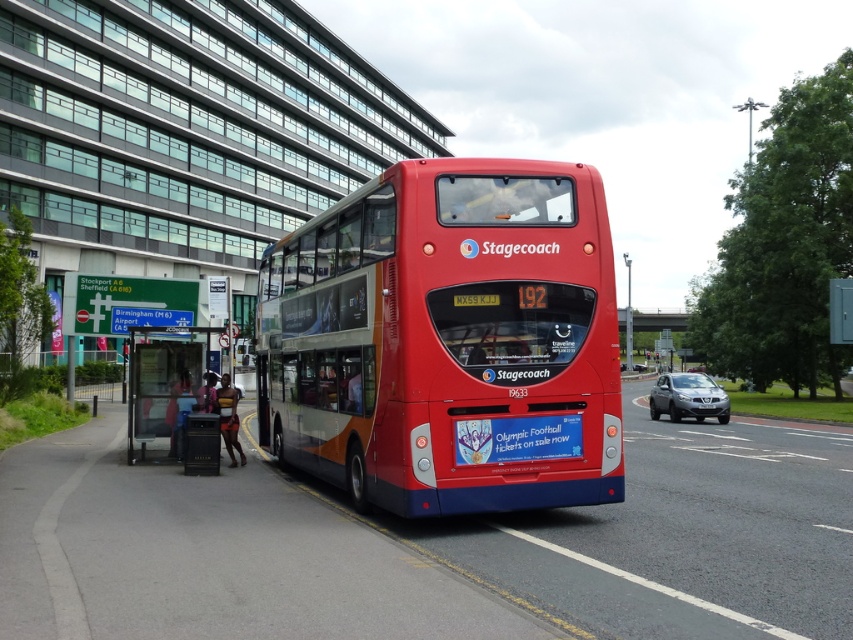
You are a pedestrian standing at the bus stop and want to see the license plate of the shiny red bus at center clearly. Can you read the license plate white plastic license plate at center from where you are standing?

The shiny red bus at center is much larger than the white plastic license plate at center, so the license plate might be too small to read clearly from a distance. You may need to move closer to the bus to see the registration details properly.

You are standing at the bus stop shelter and want to walk to the point marked as point (160, 356). Which direction should you walk relative to point (705, 401)?

You should walk towards the front of point (705, 401) to reach point (160, 356) because point (160, 356) is in front of point (705, 401).